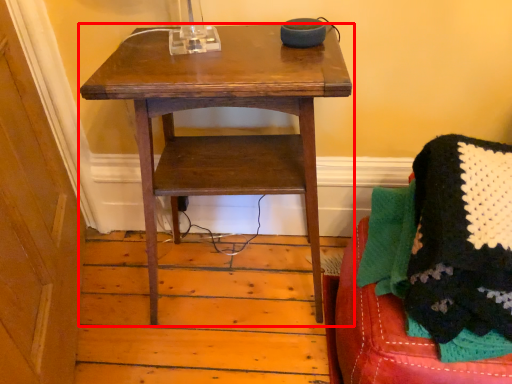
Question: From the image's perspective, where is table (annotated by the red box) located relative to furniture?

Choices:
 (A) below
 (B) above

Answer: (B)